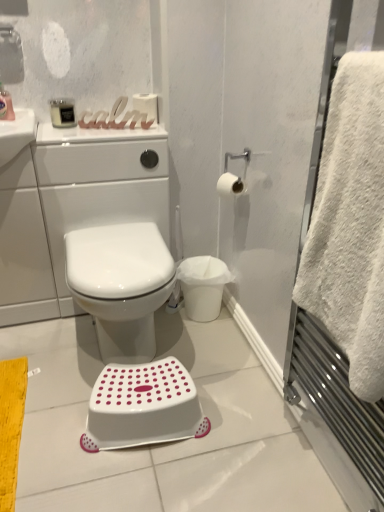
This screenshot has width=384, height=512. Identify the location of free space on the front side of matte black device at upper left, which is the first toiletry in right-to-left order. click(59, 137).